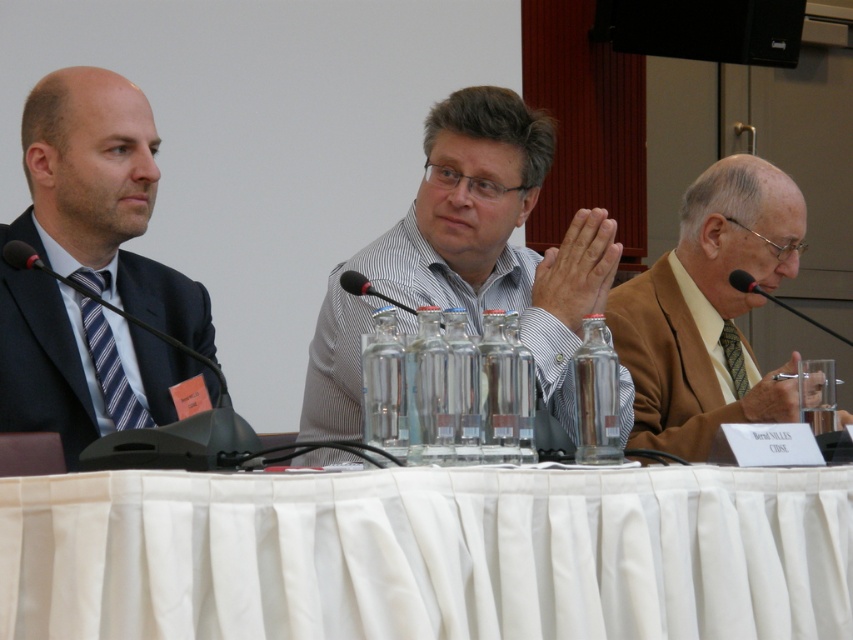
Question: Is white fabric table at center further to the viewer compared to black plastic microphone at center?

Choices:
 (A) yes
 (B) no

Answer: (B)

Question: Which point is farther to the camera?

Choices:
 (A) (762, 192)
 (B) (340, 273)
 (C) (314, 628)

Answer: (A)

Question: Can you confirm if white striped shirt at center is smaller than light brown suit at right?

Choices:
 (A) yes
 (B) no

Answer: (B)

Question: Which is farther from the white fabric table at center?

Choices:
 (A) light brown suit at right
 (B) black plastic speaker at upper center

Answer: (B)

Question: Which of these objects is positioned closest to the light brown suit at right?

Choices:
 (A) white fabric table at center
 (B) black plastic speaker at upper center
 (C) white striped shirt at center
 (D) matte black suit at left

Answer: (C)

Question: Is black plastic speaker at upper center bigger than black plastic microphone at center?

Choices:
 (A) yes
 (B) no

Answer: (A)